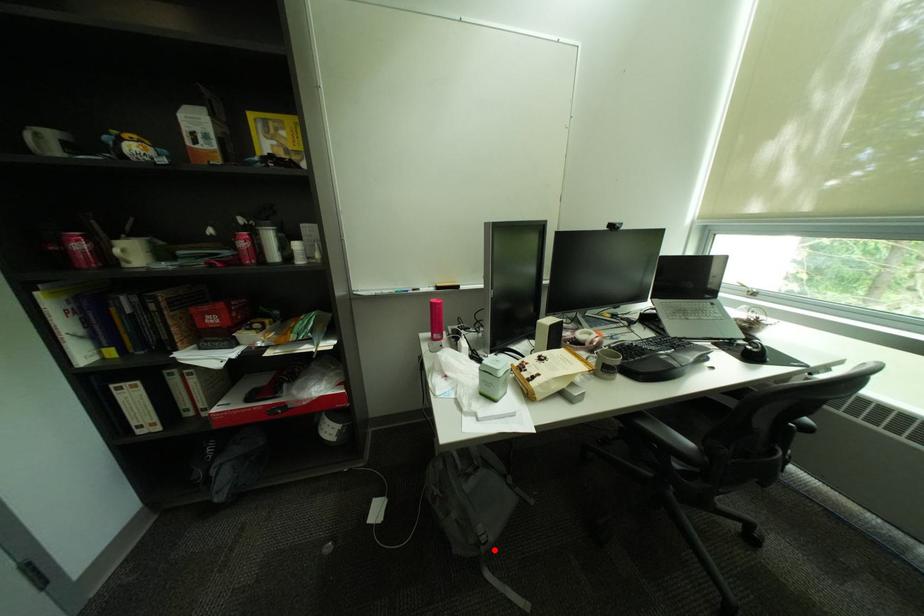
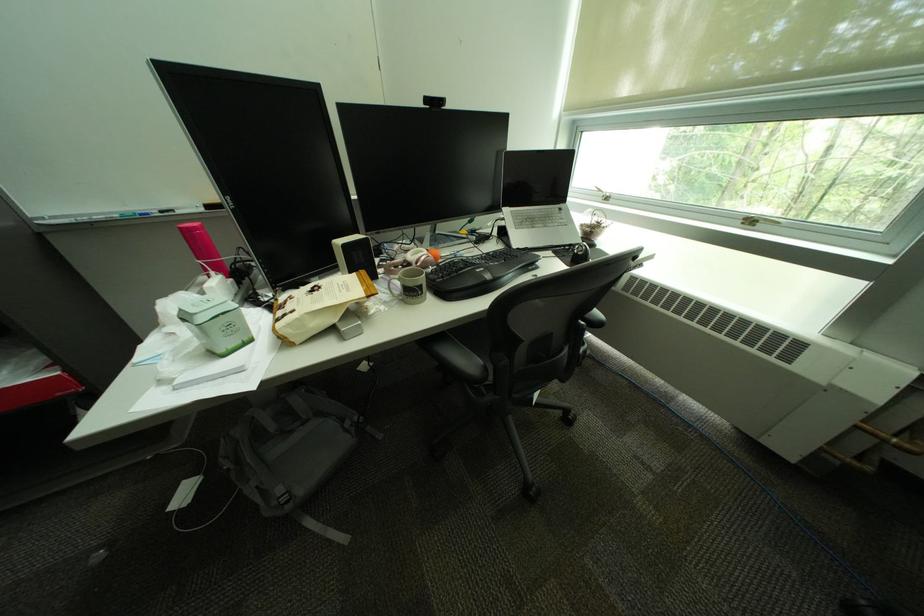
The point at the highlighted location is marked in the first image. Where is the corresponding point in the second image?

(299, 508)